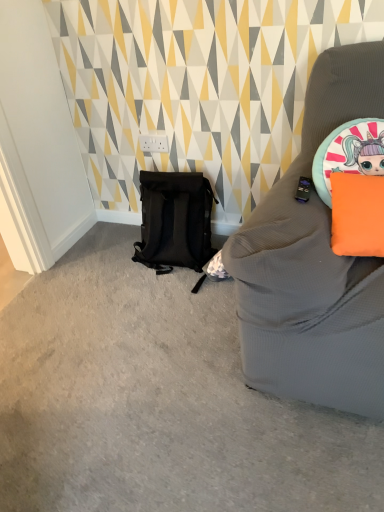
Question: Is black matte backpack at lower left outside of orange matte pillow at upper right?

Choices:
 (A) yes
 (B) no

Answer: (A)

Question: Considering the relative sizes of black matte backpack at lower left and orange matte pillow at upper right in the image provided, is black matte backpack at lower left taller than orange matte pillow at upper right?

Choices:
 (A) no
 (B) yes

Answer: (B)

Question: Is the position of black matte backpack at lower left more distant than that of orange matte pillow at upper right?

Choices:
 (A) no
 (B) yes

Answer: (B)

Question: From a real-world perspective, is black matte backpack at lower left physically above orange matte pillow at upper right?

Choices:
 (A) no
 (B) yes

Answer: (A)

Question: Considering the relative positions of black matte backpack at lower left and orange matte pillow at upper right in the image provided, is black matte backpack at lower left to the right of orange matte pillow at upper right from the viewer's perspective?

Choices:
 (A) no
 (B) yes

Answer: (A)

Question: Is black matte backpack at lower left shorter than orange matte pillow at upper right?

Choices:
 (A) yes
 (B) no

Answer: (B)

Question: Does orange matte pillow at upper right appear on the left side of black matte backpack at lower left?

Choices:
 (A) yes
 (B) no

Answer: (B)

Question: Can you confirm if orange matte pillow at upper right is taller than black matte backpack at lower left?

Choices:
 (A) yes
 (B) no

Answer: (B)

Question: Is black matte backpack at lower left located within orange matte pillow at upper right?

Choices:
 (A) yes
 (B) no

Answer: (B)

Question: Is there a large distance between orange matte pillow at upper right and black matte backpack at lower left?

Choices:
 (A) no
 (B) yes

Answer: (A)

Question: Is orange matte pillow at upper right looking in the opposite direction of black matte backpack at lower left?

Choices:
 (A) yes
 (B) no

Answer: (B)

Question: Would you say orange matte pillow at upper right is outside black matte backpack at lower left?

Choices:
 (A) yes
 (B) no

Answer: (A)

Question: Considering the positions of point (345, 200) and point (148, 211), is point (345, 200) closer or farther from the camera than point (148, 211)?

Choices:
 (A) farther
 (B) closer

Answer: (B)